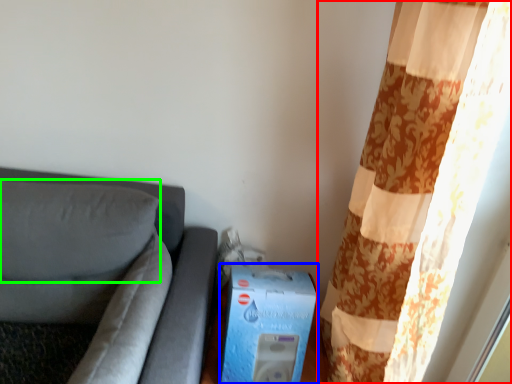
Question: Considering the real-world distances, which object is farthest from curtain (highlighted by a red box)? box (highlighted by a blue box) or pillow (highlighted by a green box)?

Choices:
 (A) box
 (B) pillow

Answer: (B)